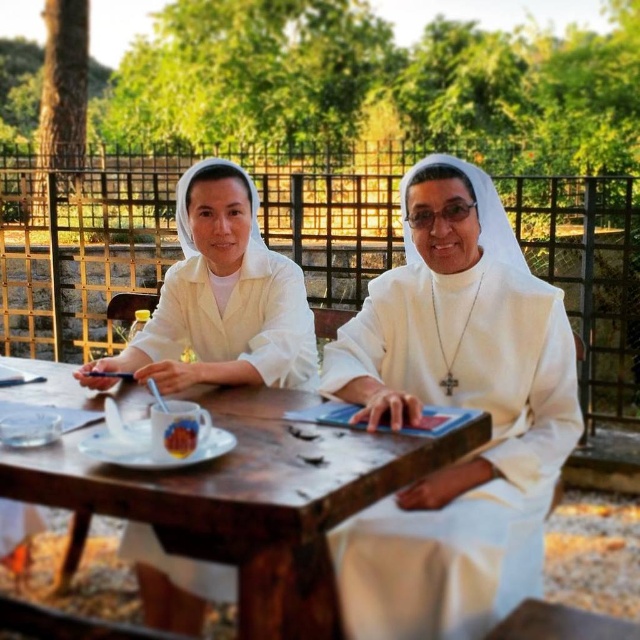
You are standing 10 feet away from the camera and want to reach the point at coordinates point (240,284). Can you reach it without moving closer?

The point (240,284) is 9.27 feet away from the camera. Since you are standing 10 feet away, you can reach it without moving closer.

You are a photographer trying to capture a closeup of the cup and saucer on the table. The cup and saucer are located at point (x=448, y=625) and point (x=204, y=221) respectively. Which point should you focus on to get the closest shot?

Point (x=448, y=625) is closer to the camera than point (x=204, y=221), so you should focus on point (x=448, y=625) to get the closest shot.